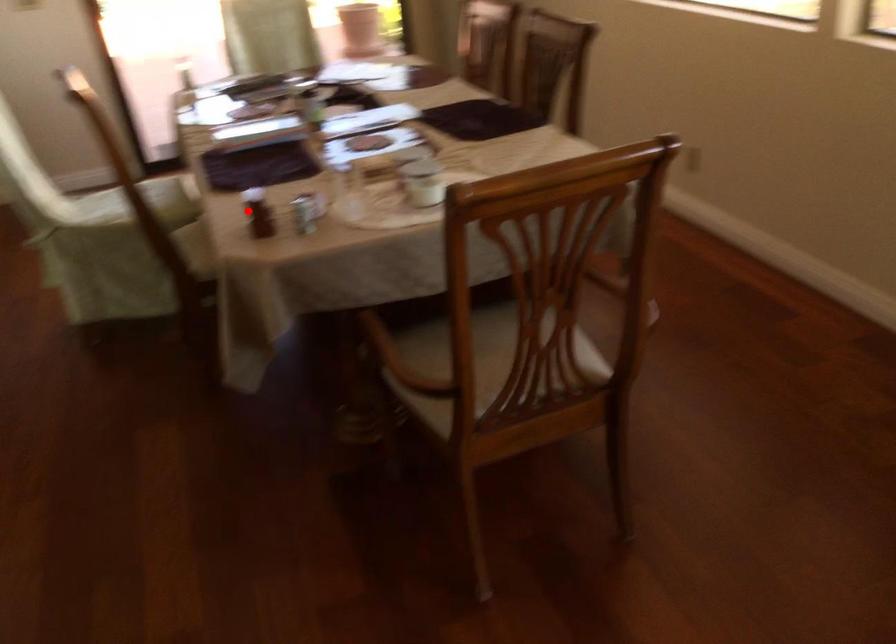
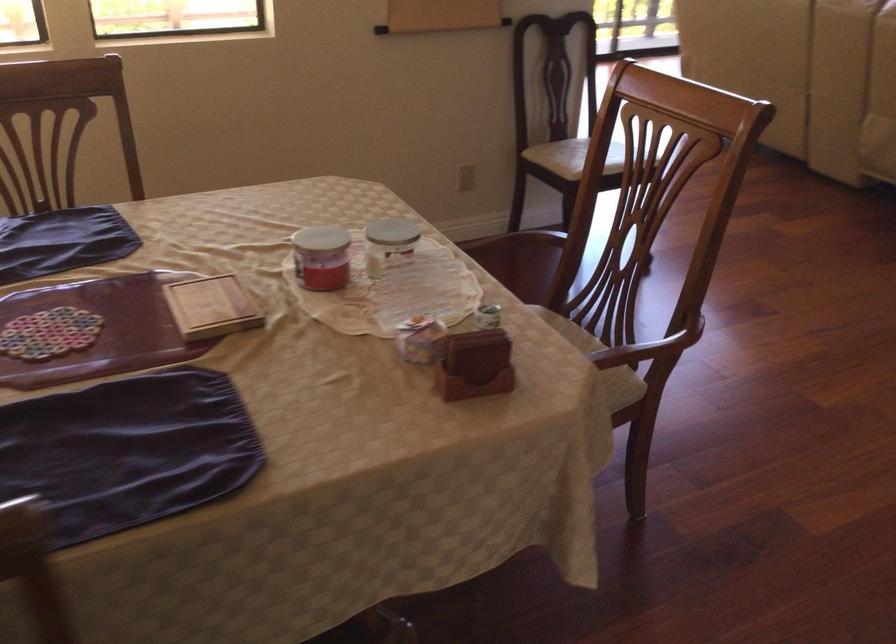
Question: I am providing you with two images of the same scene from different viewpoints. Given a red point in image1, look at the same physical point in image2. Is it:

Choices:
 (A) Closer to the viewpoint
 (B) Farther from the viewpoint

Answer: (A)